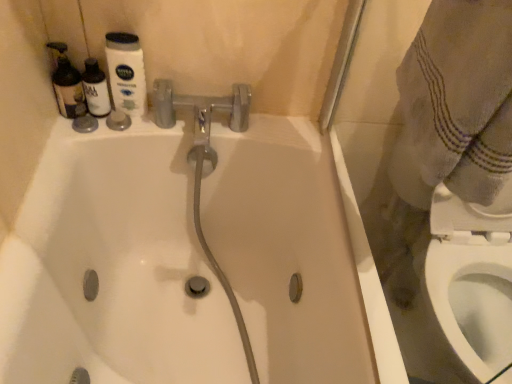
Question: From the image's perspective, is white plastic bidet at lower right positioned above or below white glossy bathtub at center?

Choices:
 (A) below
 (B) above

Answer: (A)

Question: Is white plastic bidet at lower right to the left or to the right of white glossy bathtub at center in the image?

Choices:
 (A) right
 (B) left

Answer: (A)

Question: Considering the positions of white plastic bidet at lower right and white glossy bathtub at center in the image, is white plastic bidet at lower right taller or shorter than white glossy bathtub at center?

Choices:
 (A) tall
 (B) short

Answer: (B)

Question: Which is correct: white glossy bathtub at center is inside white plastic bidet at lower right, or outside of it?

Choices:
 (A) inside
 (B) outside

Answer: (B)

Question: Is point (176, 235) closer or farther from the camera than point (440, 314)?

Choices:
 (A) closer
 (B) farther

Answer: (B)

Question: In the image, is white glossy bathtub at center positioned in front of or behind white plastic bidet at lower right?

Choices:
 (A) behind
 (B) front

Answer: (B)

Question: From the image's perspective, is white glossy bathtub at center positioned above or below white plastic bidet at lower right?

Choices:
 (A) below
 (B) above

Answer: (B)